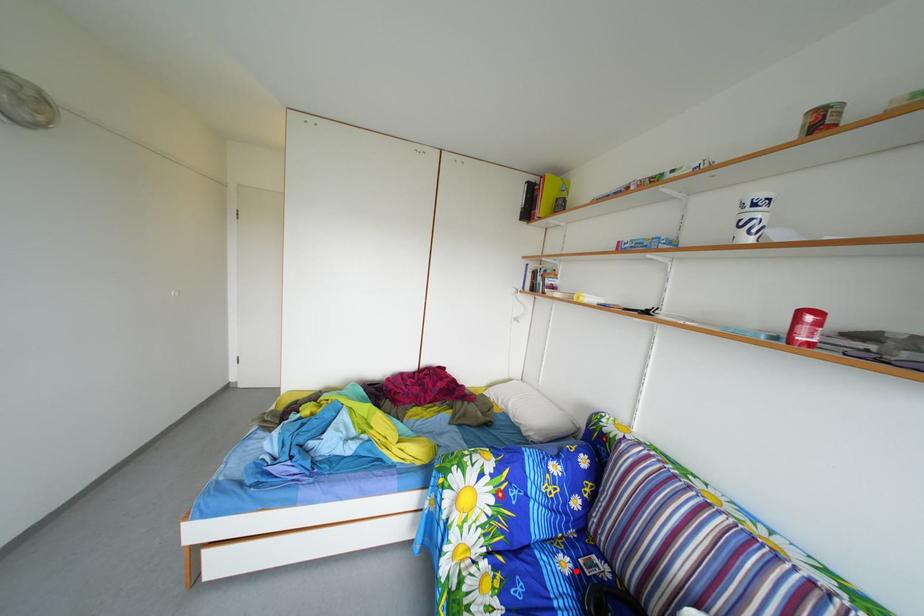
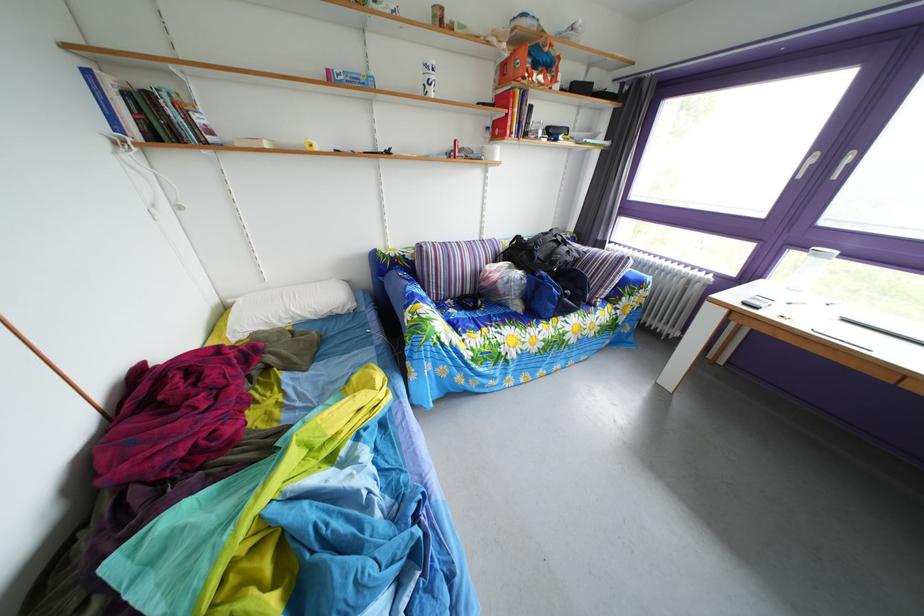
Question: I am providing you with two images of the same scene from different viewpoints. A red point is marked on the first image. At the location where the point appears in image 1, is it still visible in image 2?

Choices:
 (A) Yes
 (B) No

Answer: (A)